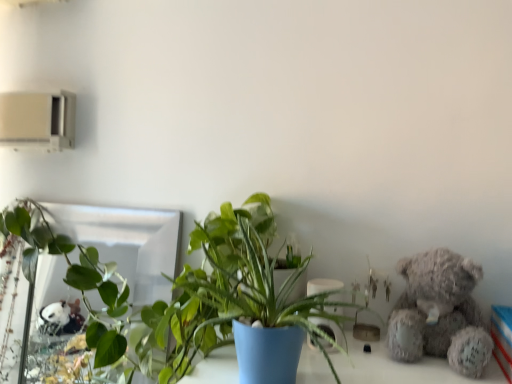
Where is `silver reflective mirror at upper left`? This screenshot has width=512, height=384. silver reflective mirror at upper left is located at coordinates (82, 273).

Image resolution: width=512 pixels, height=384 pixels. I want to click on fuzzy gray teddy bear at right, so click(x=440, y=312).

From a real-world perspective, is silver reflective mirror at upper left positioned above or below blue matte pot at center?

Clearly, from a real-world perspective, silver reflective mirror at upper left is below blue matte pot at center.

Does silver reflective mirror at upper left have a smaller size compared to blue matte pot at center?

Correct, silver reflective mirror at upper left occupies less space than blue matte pot at center.

Consider the image. From the image's perspective, is silver reflective mirror at upper left positioned above or below blue matte pot at center?

Based on their image positions, silver reflective mirror at upper left is located beneath blue matte pot at center.

Which object is positioned more to the left, silver reflective mirror at upper left or blue matte pot at center?

From the viewer's perspective, silver reflective mirror at upper left appears more on the left side.

The height and width of the screenshot is (384, 512). I want to click on teddy bear on the right side of blue matte pot at center, so click(440, 312).

Is blue matte pot at center not inside fuzzy gray teddy bear at right?

Yes, blue matte pot at center is outside of fuzzy gray teddy bear at right.

Does blue matte pot at center have a smaller size compared to fuzzy gray teddy bear at right?

No, blue matte pot at center is not smaller than fuzzy gray teddy bear at right.

In the image, is blue matte pot at center positioned in front of or behind fuzzy gray teddy bear at right?

In the image, blue matte pot at center appears in front of fuzzy gray teddy bear at right.

Is point (85, 224) positioned before point (434, 279)?

No, it is not.

Based on the photo, is silver reflective mirror at upper left in front of or behind fuzzy gray teddy bear at right in the image?

silver reflective mirror at upper left is behind fuzzy gray teddy bear at right.

How distant is silver reflective mirror at upper left from fuzzy gray teddy bear at right?

silver reflective mirror at upper left is 68.35 centimeters from fuzzy gray teddy bear at right.

Find the location of `mirror below the fuzzy gray teddy bear at right (from the image's perspective)`. mirror below the fuzzy gray teddy bear at right (from the image's perspective) is located at coordinates (82, 273).

Would you consider fuzzy gray teddy bear at right to be distant from blue matte pot at center?

That's not correct — fuzzy gray teddy bear at right is a little close to blue matte pot at center.

Does fuzzy gray teddy bear at right have a greater width compared to blue matte pot at center?

In fact, fuzzy gray teddy bear at right might be narrower than blue matte pot at center.

From the image's perspective, is fuzzy gray teddy bear at right on top of blue matte pot at center?

Actually, fuzzy gray teddy bear at right appears below blue matte pot at center in the image.

Is the position of fuzzy gray teddy bear at right more distant than that of blue matte pot at center?

Yes, it is behind blue matte pot at center.

Considering the positions of objects blue matte pot at center and silver reflective mirror at upper left in the image provided, who is behind, blue matte pot at center or silver reflective mirror at upper left?

silver reflective mirror at upper left is further away from the camera.

Is point (250, 240) farther from viewer compared to point (53, 377)?

No, (250, 240) is closer to viewer.

Is blue matte pot at center located outside silver reflective mirror at upper left?

Yes, blue matte pot at center is not within silver reflective mirror at upper left.

Which is more to the left, blue matte pot at center or silver reflective mirror at upper left?

From the viewer's perspective, silver reflective mirror at upper left appears more on the left side.

Considering the positions of point (418, 292) and point (3, 312), is point (418, 292) closer or farther from the camera than point (3, 312)?

Point (418, 292) is closer to the camera than point (3, 312).

From a real-world perspective, is fuzzy gray teddy bear at right located beneath silver reflective mirror at upper left?

No, from a real-world perspective, fuzzy gray teddy bear at right is not beneath silver reflective mirror at upper left.

Find the location of a particular element. This screenshot has width=512, height=384. teddy bear above the silver reflective mirror at upper left (from the image's perspective) is located at coordinates (440, 312).

Can silver reflective mirror at upper left be found inside fuzzy gray teddy bear at right?

No, silver reflective mirror at upper left is not inside fuzzy gray teddy bear at right.

You are a GUI agent. You are given a task and a screenshot of the screen. Output one action in this format:
    pyautogui.click(x=<x>, y=<y>)
    Task: Click on the mirror located on the left of blue matte pot at center
    The height and width of the screenshot is (384, 512).
    Given the screenshot: What is the action you would take?
    pyautogui.click(x=82, y=273)

Where is `teddy bear behind the blue matte pot at center`? Image resolution: width=512 pixels, height=384 pixels. teddy bear behind the blue matte pot at center is located at coordinates (440, 312).

Based on their spatial positions, is fuzzy gray teddy bear at right or silver reflective mirror at upper left closer to blue matte pot at center?

Among the two, silver reflective mirror at upper left is located nearer to blue matte pot at center.

Looking at the image, which one is located further to blue matte pot at center, silver reflective mirror at upper left or fuzzy gray teddy bear at right?

The object further to blue matte pot at center is fuzzy gray teddy bear at right.

In the scene shown: Based on their spatial positions, is fuzzy gray teddy bear at right or blue matte pot at center closer to silver reflective mirror at upper left?

The object closer to silver reflective mirror at upper left is blue matte pot at center.

When comparing their distances from fuzzy gray teddy bear at right, does silver reflective mirror at upper left or blue matte pot at center seem further?

silver reflective mirror at upper left lies further to fuzzy gray teddy bear at right than the other object.

When comparing their distances from silver reflective mirror at upper left, does blue matte pot at center or fuzzy gray teddy bear at right seem further?

The object further to silver reflective mirror at upper left is fuzzy gray teddy bear at right.

When comparing their distances from fuzzy gray teddy bear at right, does blue matte pot at center or silver reflective mirror at upper left seem further?

silver reflective mirror at upper left is positioned further to the anchor fuzzy gray teddy bear at right.

Where is `houseplant between silver reflective mirror at upper left and fuzzy gray teddy bear at right`? Image resolution: width=512 pixels, height=384 pixels. houseplant between silver reflective mirror at upper left and fuzzy gray teddy bear at right is located at coordinates (178, 289).